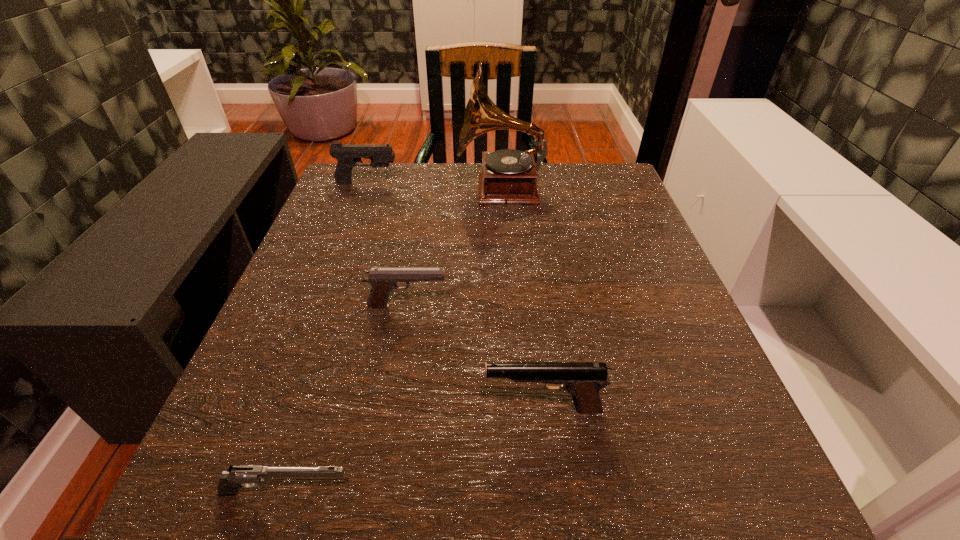
The width and height of the screenshot is (960, 540). Find the location of `phonograph_record`. phonograph_record is located at coordinates (508, 176).

Find the location of `the farthest pistol`. the farthest pistol is located at coordinates (347, 156).

Locate an element on the screen. the second nearest object is located at coordinates (583, 380).

Locate an element on the screen. The height and width of the screenshot is (540, 960). the second nearest pistol is located at coordinates (583, 380).

Identify the location of the second shortest pistol. The width and height of the screenshot is (960, 540). (383, 280).

I want to click on the second farthest pistol, so click(x=383, y=280).

Locate an element on the screen. The image size is (960, 540). the shortest object is located at coordinates click(249, 476).

Locate an element on the screen. The width and height of the screenshot is (960, 540). the nearest object is located at coordinates (249, 476).

In order to click on vacant space situated 0.160m on the horn of the tallest object in this screenshot , I will do `click(392, 190)`.

You are a GUI agent. You are given a task and a screenshot of the screen. Output one action in this format:
    pyautogui.click(x=<x>, y=<y>)
    Task: Click on the vacant space located on the horn of the tallest object
    
    Given the screenshot: What is the action you would take?
    pyautogui.click(x=388, y=190)